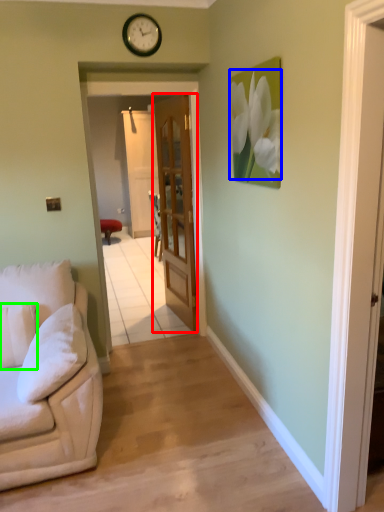
Question: Estimate the real-world distances between objects in this image. Which object is closer to door (highlighted by a red box), flower (highlighted by a blue box) or pillow (highlighted by a green box)?

Choices:
 (A) flower
 (B) pillow

Answer: (A)